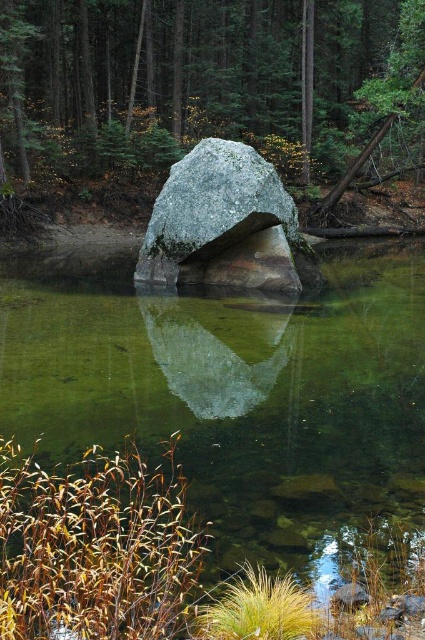
Looking at this image, you are a photographer planning to capture the reflection of the gray granite boulder at center in the clear glass water at center. Given that the water is taller than the boulder, will the reflection of the boulder be fully visible in the water?

The clear glass water at center is taller than the gray granite boulder at center, so the reflection of the gray granite boulder at center will be fully visible in the clear glass water at center since the water reaches above the boulder, allowing its entire reflection to form.

In the scene shown: You are standing at the edge of the water and want to reach both the point at point (354, 285) and the point at point (161, 49). Which point do you need to walk further to reach?

Point (161, 49) is further away from the viewer than point (354, 285), so you need to walk further to reach point (161, 49).